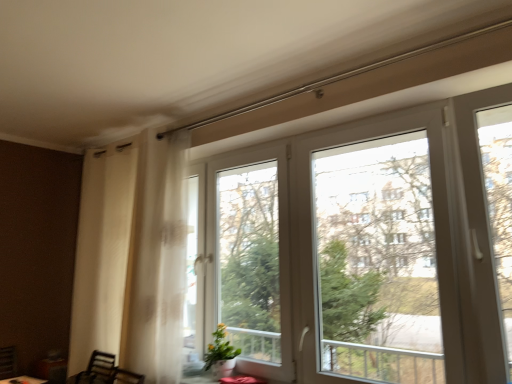
Question: In the image, is transparent glass window at center, the 1th window screen viewed from the left, positioned in front of or behind yellow-green leafy plant at lower center?

Choices:
 (A) front
 (B) behind

Answer: (A)

Question: Considering the positions of point (229, 296) and point (215, 347), is point (229, 296) closer or farther from the camera than point (215, 347)?

Choices:
 (A) closer
 (B) farther

Answer: (B)

Question: Which is nearer to the matte red table at lower center?

Choices:
 (A) matte brown round table at lower left
 (B) transparent plastic window at upper center, placed as the first window screen when sorted from right to left
 (C) transparent glass window at center, which is the second window screen in right-to-left order
 (D) yellow-green leafy plant at lower center

Answer: (D)

Question: Which object is the farthest from the transparent glass window at center, the 1th window screen viewed from the left?

Choices:
 (A) matte red table at lower center
 (B) matte brown round table at lower left
 (C) transparent plastic window at upper center, arranged as the second window screen when viewed from the left
 (D) yellow-green leafy plant at lower center

Answer: (B)